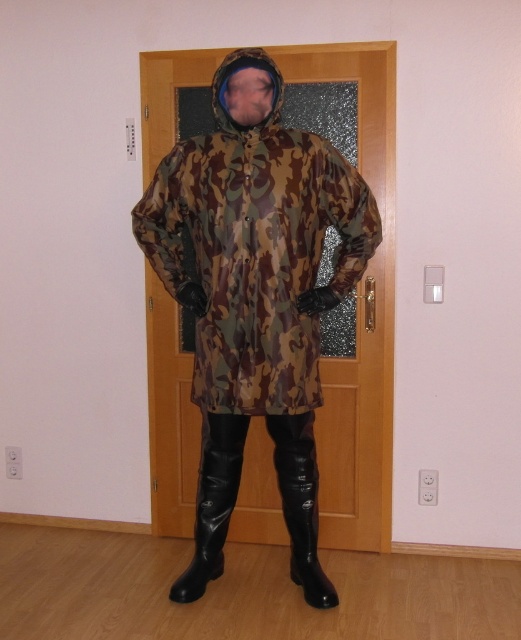
You are trying to determine if the camouflage fabric jacket at center can fit through a narrow doorway that is the same width as the black patent leather boot at lower center. Can it fit?

The camouflage fabric jacket at center might be wider than the black patent leather boot at lower center, so it may not fit through the doorway.

You are a delivery robot that is 1.5 meters tall. You need to deliver a package to the person standing in front of the door. The package is too large to hold, so you must place it on the floor near the person. However, you can only place the package within 1.5 meters of your position. If you position yourself directly in front of the person, will you be able to place the package between the black patent leather boot at lower center and the camo fabric hood at center without moving?

The distance between the black patent leather boot at lower center and the camo fabric hood at center is 1.42 meters, which is within the 1.5 meters limit. Therefore, you can place the package between them without moving.

From the picture: You are a fashion designer trying to create a new line of outdoor gear. You have a camouflage fabric jacket at center and a black patent leather boot at lower center in front of you. Which item would require more fabric to produce, and why?

The camouflage fabric jacket at center requires more fabric to produce because it is larger in size than the black patent leather boot at lower center.